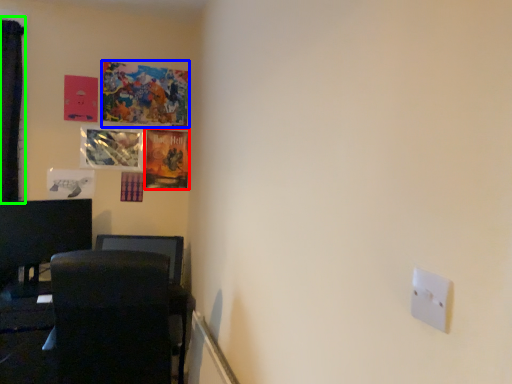
Question: Considering the real-world distances, which object is closest to picture frame (highlighted by a red box)? picture frame (highlighted by a blue box) or curtain (highlighted by a green box).

Choices:
 (A) picture frame
 (B) curtain

Answer: (A)